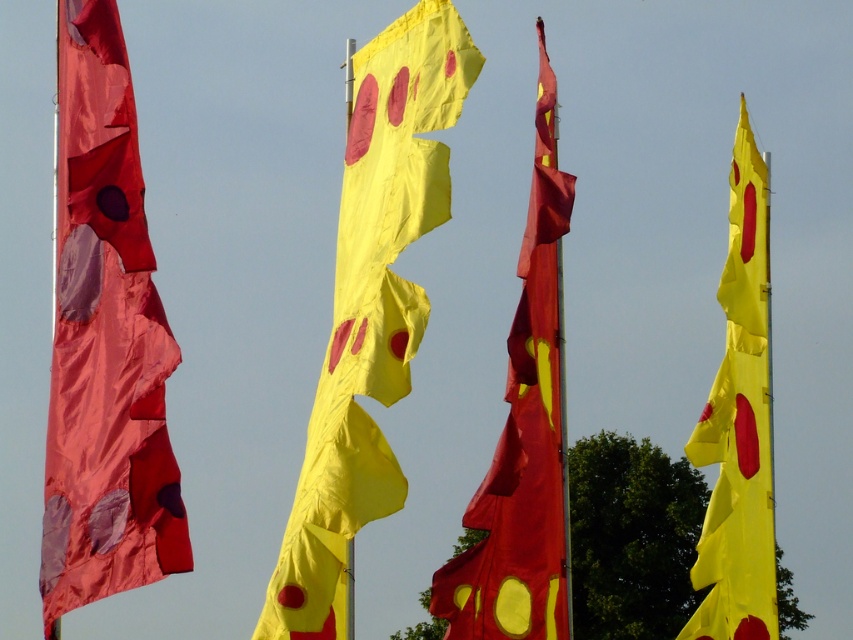
Between point (71, 442) and point (405, 237), which one is positioned behind?

The point (405, 237) is more distant.

Which is above, matte red fabric flag at left or yellow fabric flag at center?

yellow fabric flag at center is higher up.

Who is more forward, [111,288] or [422,330]?

Point [111,288] is in front.

The image size is (853, 640). I want to click on matte red fabric flag at left, so click(x=103, y=340).

Which is below, matte red fabric flag at left or yellow matte fabric flag at center?

matte red fabric flag at left is lower down.

Who is more distant from viewer, (136,468) or (550,307)?

The point (550,307) is behind.

Identify the location of matte red fabric flag at left. This screenshot has width=853, height=640. (103, 340).

Does yellow fabric flag at center have a greater width compared to yellow fabric flag at right?

Yes.

Who is shorter, yellow fabric flag at center or yellow fabric flag at right?

yellow fabric flag at center is shorter.

Identify the location of yellow fabric flag at center. (370, 307).

Where is `yellow fabric flag at center`? The height and width of the screenshot is (640, 853). yellow fabric flag at center is located at coordinates (370, 307).